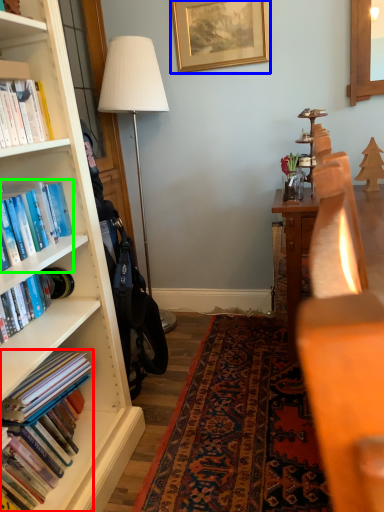
Question: Based on their relative distances, which object is nearer to book (highlighted by a red box)? Choose from picture frame (highlighted by a blue box) and book (highlighted by a green box).

Choices:
 (A) picture frame
 (B) book

Answer: (B)